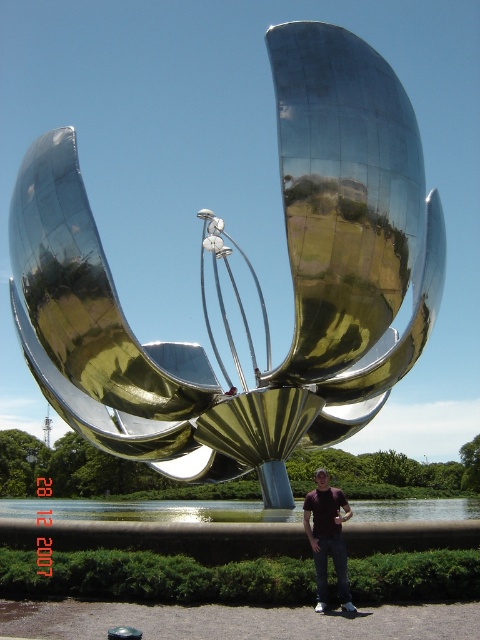
Who is more distant from viewer, (73, 312) or (308, 525)?

Point (73, 312)

Does point (358, 362) come farther from viewer compared to point (346, 579)?

Yes, it is behind point (346, 579).

Where is `polished metallic flower at center`? polished metallic flower at center is located at coordinates 253,280.